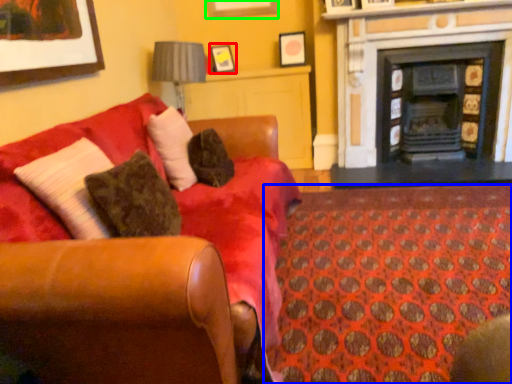
Question: Which object is positioned farthest from picture frame (highlighted by a red box)? Select from pattern (highlighted by a blue box) and picture frame (highlighted by a green box).

Choices:
 (A) pattern
 (B) picture frame

Answer: (A)